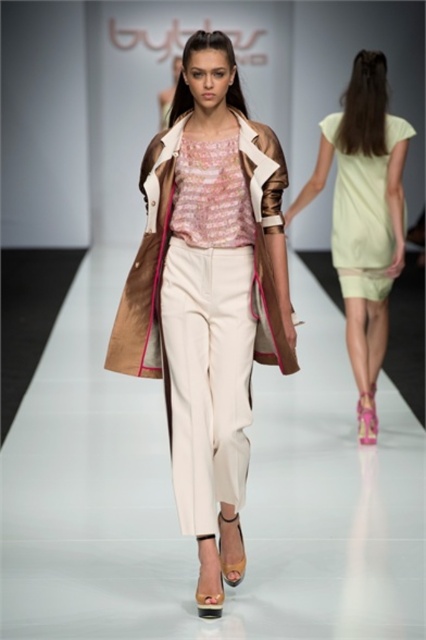
Is metallic gold coat at center in front of light yellow fabric dress at back?

Yes, metallic gold coat at center is in front of light yellow fabric dress at back.

Which is in front, point (173, 113) or point (374, 83)?

Point (173, 113) is in front.

What do you see at coordinates (209, 296) in the screenshot? I see `metallic gold coat at center` at bounding box center [209, 296].

Identify the location of metallic gold coat at center. The height and width of the screenshot is (640, 426). (209, 296).